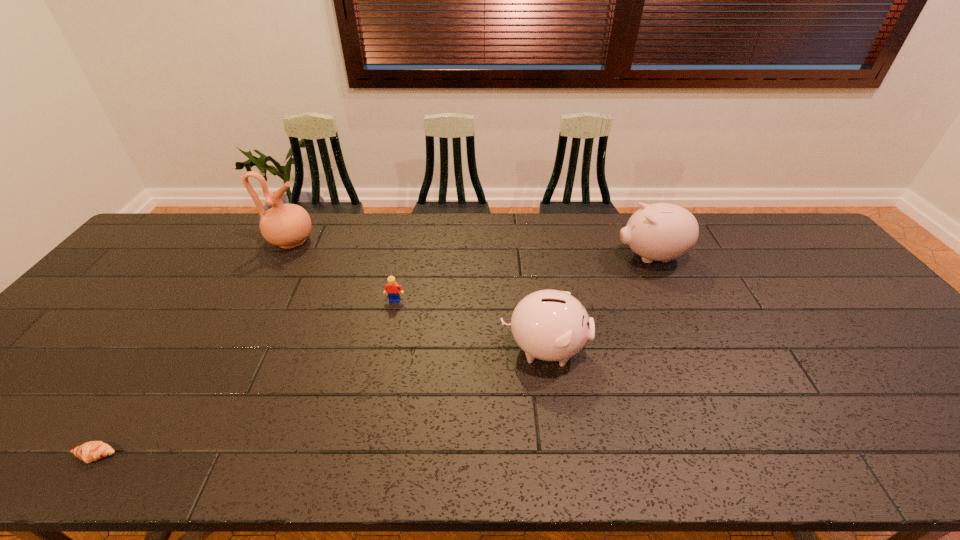
Find the location of a particular element. blank space at the near edge of the desktop is located at coordinates click(x=874, y=438).

Locate an element on the screen. vacant space at the right edge of the desktop is located at coordinates (898, 345).

Find the location of a particular element. The width and height of the screenshot is (960, 540). free region at the far right corner of the desktop is located at coordinates (771, 242).

Identify the location of free space between the tallest object and the fourth farthest object. (418, 295).

At what (x,y) coordinates should I click in order to perform the action: click on blank region between the Lego and the farther piggy bank. Please return your answer as a coordinate pair (x, y). This screenshot has width=960, height=540. Looking at the image, I should click on (523, 279).

Where is `free space between the farther piggy bank and the shortest object`? This screenshot has width=960, height=540. free space between the farther piggy bank and the shortest object is located at coordinates coord(373,356).

At what (x,y) coordinates should I click in order to perform the action: click on vacant point located between the nearer piggy bank and the pottery. Please return your answer as a coordinate pair (x, y). Image resolution: width=960 pixels, height=540 pixels. Looking at the image, I should click on (418, 295).

I want to click on vacant area between the rightmost object and the fourth farthest object, so click(597, 303).

The height and width of the screenshot is (540, 960). Identify the location of unoccupied position between the nearest object and the left piggy bank. (320, 402).

The image size is (960, 540). In order to click on blank region between the rightmost object and the fourth object from left to right in this screenshot , I will do `click(597, 303)`.